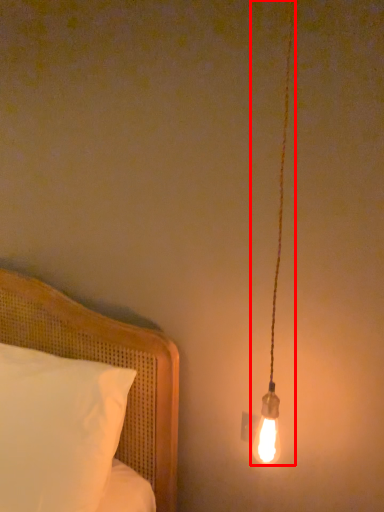
Question: In this image, where is lamp (annotated by the red box) located relative to bed?

Choices:
 (A) left
 (B) right

Answer: (B)